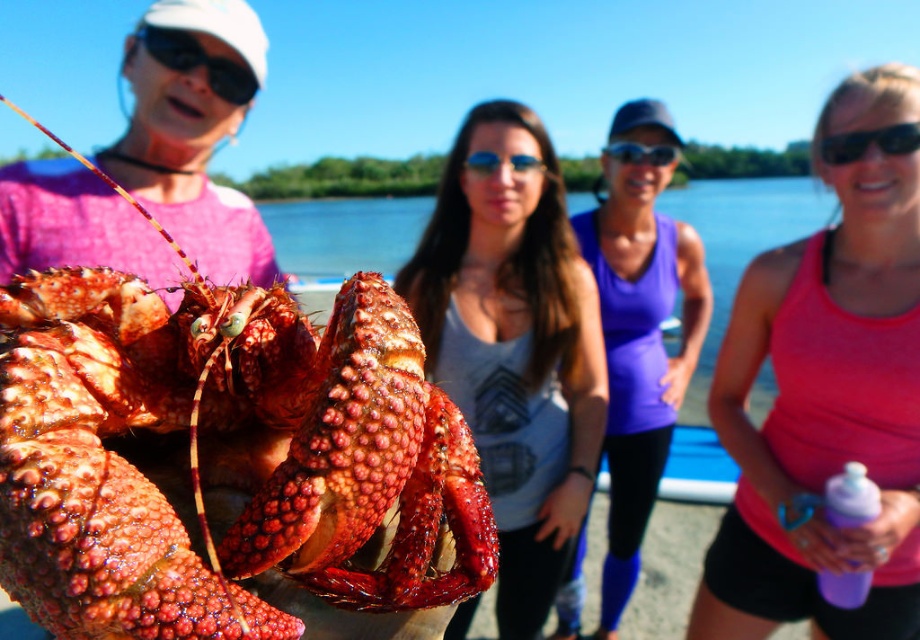
Question: Can you confirm if purple plastic bottle at lower right is positioned above glossy plastic goggles at center?

Choices:
 (A) no
 (B) yes

Answer: (A)

Question: Which object is positioned closest to the purple fabric tank top at center?

Choices:
 (A) black plastic sunglasses at upper right
 (B) shiny red lobster at left
 (C) matte gray tank top at center
 (D) black plastic goggles at upper left

Answer: (C)

Question: Can you confirm if pink fabric tank top at right is wider than purple plastic bottle at lower right?

Choices:
 (A) yes
 (B) no

Answer: (A)

Question: Based on their relative distances, which object is farther from the blue reflective glasses at center?

Choices:
 (A) glossy plastic goggles at center
 (B) shiny red lobster at left

Answer: (B)

Question: Where is purple fabric tank top at center located in relation to black plastic goggles at upper left in the image?

Choices:
 (A) above
 (B) below

Answer: (B)

Question: Which point is farther to the camera?

Choices:
 (A) (653, 154)
 (B) (524, 161)
 (C) (864, 480)
 (D) (565, 273)

Answer: (A)